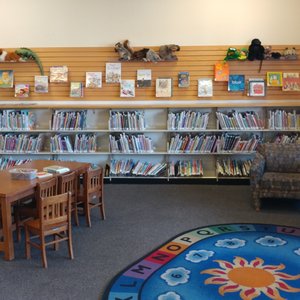
This screenshot has width=300, height=300. Find the location of `back of chair`. back of chair is located at coordinates (55, 199), (49, 185), (69, 177), (96, 173).